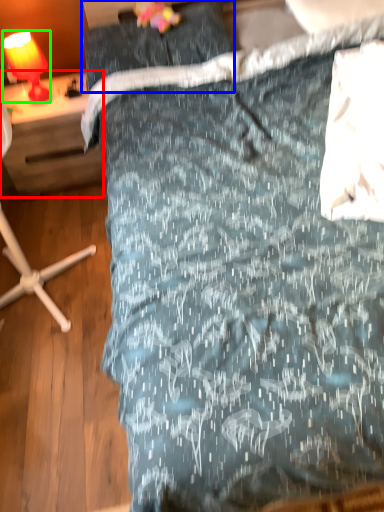
Question: Considering the real-world distances, which object is farthest from desk (highlighted by a red box)? pillow (highlighted by a blue box) or lamp (highlighted by a green box)?

Choices:
 (A) pillow
 (B) lamp

Answer: (A)